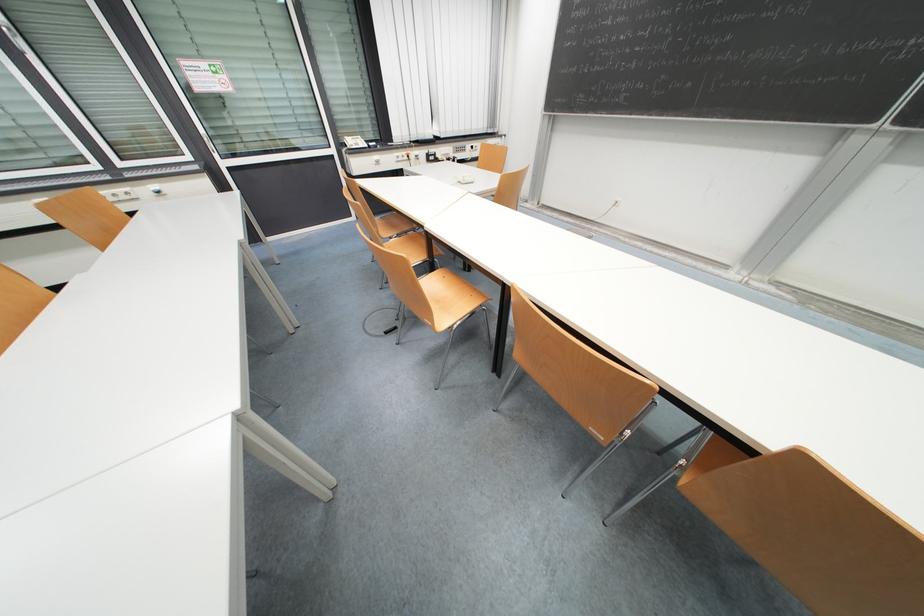
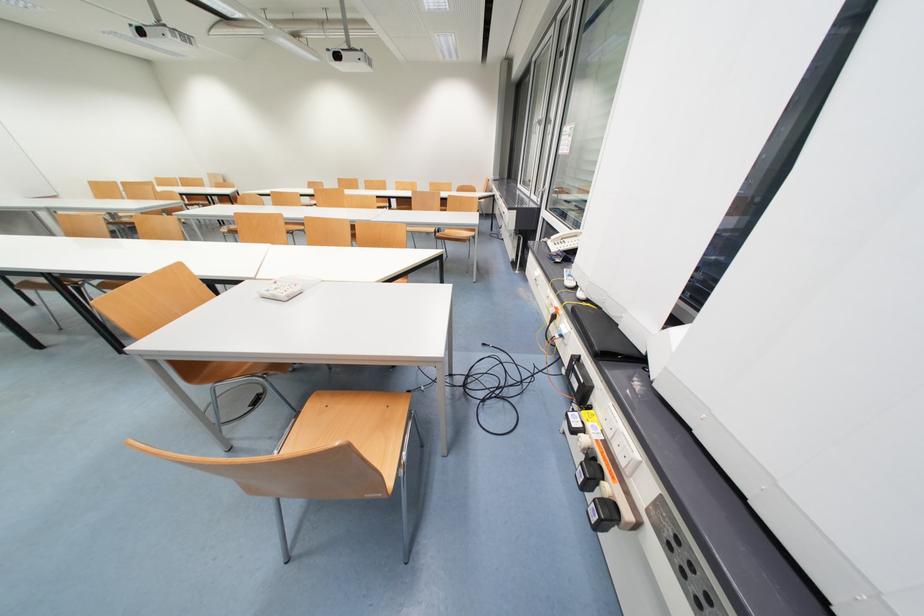
The point at (414, 159) is marked in the first image. Where is the corresponding point in the second image?

(560, 318)